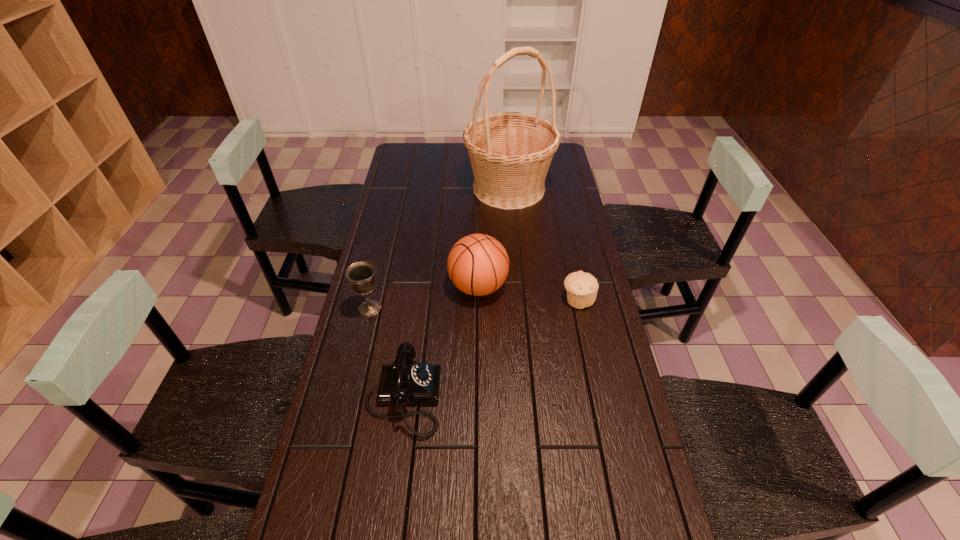
Identify the location of the tallest object. This screenshot has width=960, height=540. (510, 152).

The width and height of the screenshot is (960, 540). Find the location of `basket`. basket is located at coordinates (510, 152).

Locate an element on the screen. This screenshot has width=960, height=540. basketball is located at coordinates (478, 264).

At what (x,y) coordinates should I click in order to perform the action: click on the third tallest object. Please return your answer as a coordinate pair (x, y). This screenshot has width=960, height=540. Looking at the image, I should click on (360, 274).

The width and height of the screenshot is (960, 540). In order to click on chalice in this screenshot , I will do `click(360, 274)`.

I want to click on the second object from left to right, so click(405, 381).

Where is `the nearest object`? The width and height of the screenshot is (960, 540). the nearest object is located at coordinates 405,381.

You are a GUI agent. You are given a task and a screenshot of the screen. Output one action in this format:
    pyautogui.click(x=<x>, y=<y>)
    Task: Click on the muffin
    The image size is (960, 540).
    Given the screenshot: What is the action you would take?
    pyautogui.click(x=581, y=287)

Where is `vacant space situated on the left of the basket`? The height and width of the screenshot is (540, 960). vacant space situated on the left of the basket is located at coordinates (407, 188).

I want to click on free space located 0.200m on the right of the basketball, so click(568, 287).